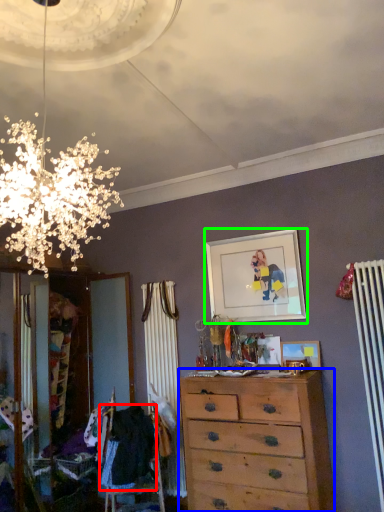
Question: Which object is the closest to the clothing (highlighted by a red box)? Choose among these: chest of drawers (highlighted by a blue box) or picture frame (highlighted by a green box).

Choices:
 (A) chest of drawers
 (B) picture frame

Answer: (A)